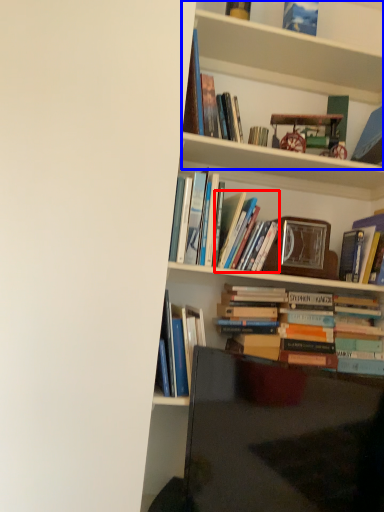
Question: Which object is further to the camera taking this photo, book (highlighted by a red box) or shelf (highlighted by a blue box)?

Choices:
 (A) book
 (B) shelf

Answer: (A)